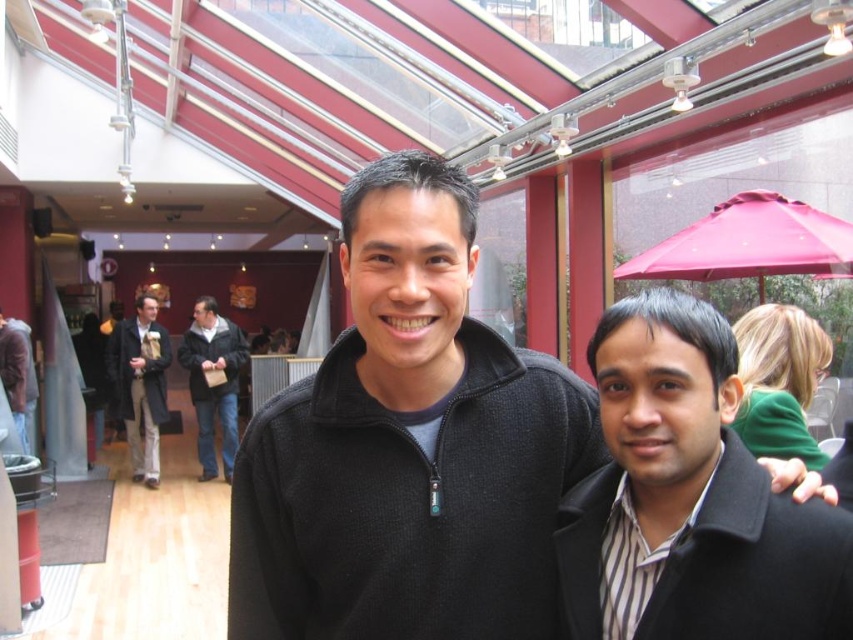
You are standing in the shopping mall and see two points marked in the image. Which point, point [722,236] or point [131,451], is closer to you?

Point [722,236] is closer to the viewer than point [131,451].

You are a tailor measuring the distance between two pieces of clothing for a display. The dark brown leather coat at left and the dark brown leather jacket at center need to be placed on a rack. The rack has a maximum spacing capacity of 20 inches between hangers. Can both items be placed on the same rack without exceeding the rack spacing limit?

The distance between the dark brown leather coat at left and the dark brown leather jacket at center is 19.55 inches, which is under the 20 inch limit. Therefore, both items can be placed on the same rack without exceeding the spacing capacity.

You are a fashion designer observing the dark brown leather coat at left and the dark brown leather jacket at center in the image. Which one would you recommend to a client who prefers a more oversized style?

The dark brown leather coat at left is larger in size than the dark brown leather jacket at center, so it would be the better recommendation for an oversized style.